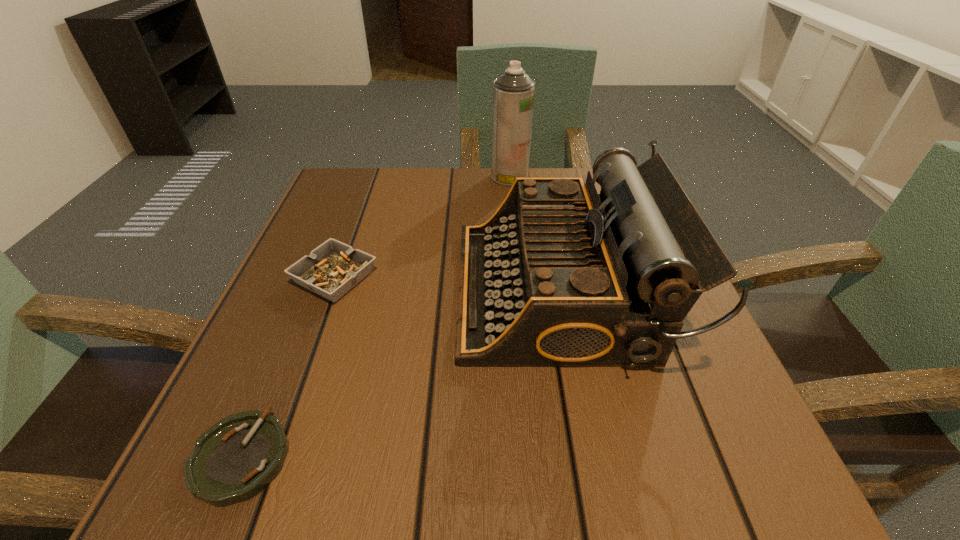
Identify the location of aerosol can. The height and width of the screenshot is (540, 960). (513, 92).

Locate an element on the screen. The height and width of the screenshot is (540, 960). the farthest object is located at coordinates (513, 92).

I want to click on typewriter, so click(x=559, y=276).

I want to click on the second shortest object, so click(332, 269).

Locate an element on the screen. the farther ashtray is located at coordinates (332, 269).

The height and width of the screenshot is (540, 960). I want to click on the shorter ashtray, so click(x=236, y=458).

Identify the location of the nearest object. The image size is (960, 540). (236, 458).

Where is `vacant space located 0.060m on the right of the aerosol can`? Image resolution: width=960 pixels, height=540 pixels. vacant space located 0.060m on the right of the aerosol can is located at coordinates (553, 177).

The height and width of the screenshot is (540, 960). In order to click on vacant area located on the keyboard of the second tallest object in this screenshot , I will do `click(420, 291)`.

This screenshot has width=960, height=540. In order to click on vacant region located on the keyboard of the second tallest object in this screenshot , I will do `click(314, 291)`.